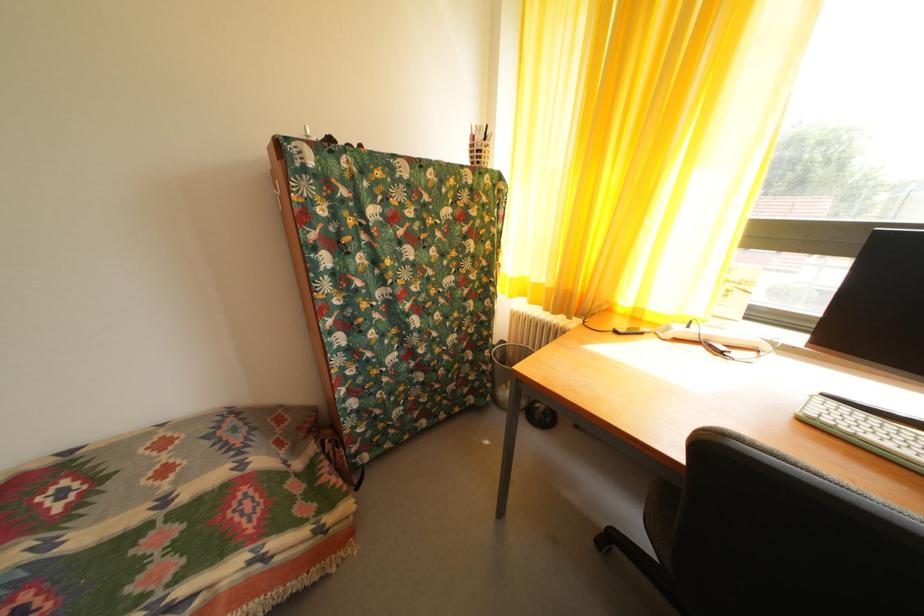
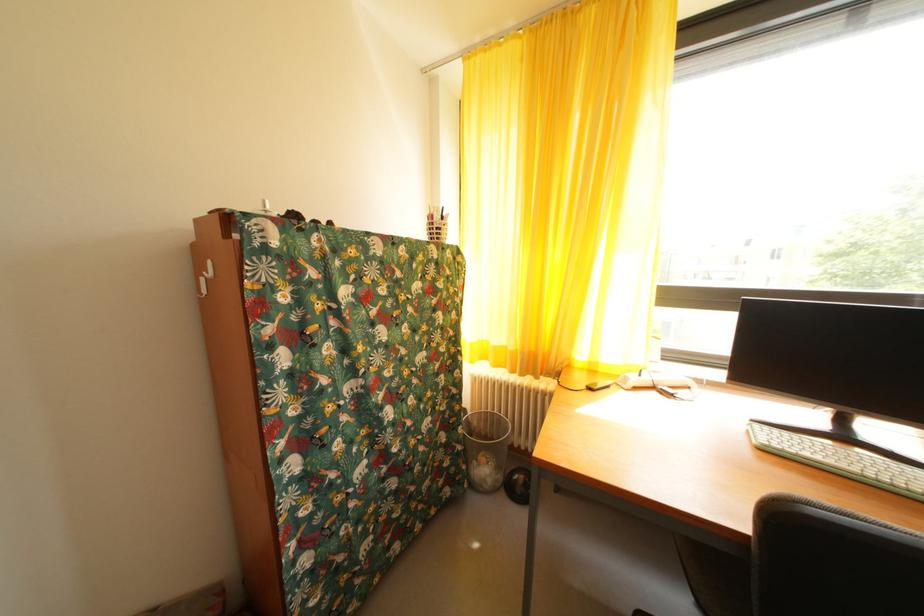
In a continuous first-person perspective shot, in which direction is the camera moving?

The cameraman walked toward left, forward.